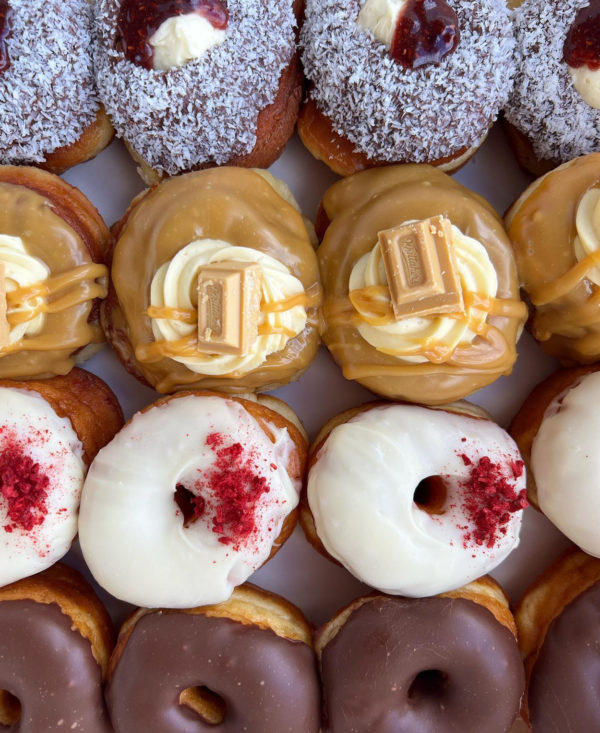
Locate an element on the screen. tray is located at coordinates (321, 399).